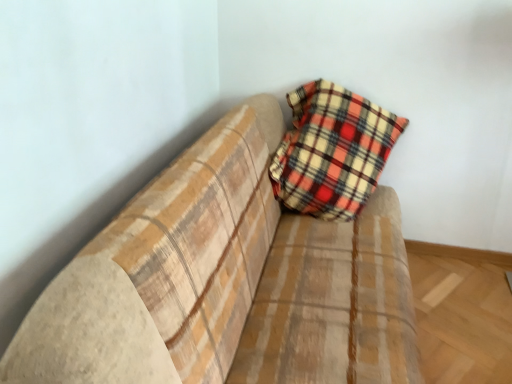
Find the location of `plaid fabric couch at upper right`. plaid fabric couch at upper right is located at coordinates (226, 282).

From the picture: Measure the distance between point (359,350) and camera.

They are 1.32 meters apart.

This screenshot has height=384, width=512. Describe the element at coordinates (226, 282) in the screenshot. I see `plaid fabric couch at upper right` at that location.

Measure the distance between plaid fabric couch at upper right and camera.

A distance of 24.68 inches exists between plaid fabric couch at upper right and camera.

What is the approximate width of plaid fabric couch at upper right?

plaid fabric couch at upper right is 93.91 centimeters in width.

The width and height of the screenshot is (512, 384). What are the coordinates of `plaid fabric pillow at center` in the screenshot? It's located at (332, 151).

What do you see at coordinates (332, 151) in the screenshot? The height and width of the screenshot is (384, 512). I see `plaid fabric pillow at center` at bounding box center [332, 151].

Where is `plaid fabric couch at upper right`? This screenshot has width=512, height=384. plaid fabric couch at upper right is located at coordinates (226, 282).

Is plaid fabric pillow at center to the left or to the right of plaid fabric couch at upper right in the image?

plaid fabric pillow at center is to the right of plaid fabric couch at upper right.

Is plaid fabric pillow at center positioned behind plaid fabric couch at upper right?

Yes, it is behind plaid fabric couch at upper right.

Considering the points (326, 144) and (378, 287), which point is in front, point (326, 144) or point (378, 287)?

The point (378, 287) is closer to the camera.

From the image's perspective, which object appears higher, plaid fabric pillow at center or plaid fabric couch at upper right?

plaid fabric pillow at center, from the image's perspective.

From a real-world perspective, who is located lower, plaid fabric pillow at center or plaid fabric couch at upper right?

plaid fabric couch at upper right, from a real-world perspective.

Does plaid fabric pillow at center have a lesser width compared to plaid fabric couch at upper right?

Yes.

Who is shorter, plaid fabric pillow at center or plaid fabric couch at upper right?

With less height is plaid fabric pillow at center.

Based on their sizes in the image, would you say plaid fabric pillow at center is bigger or smaller than plaid fabric couch at upper right?

Considering their sizes, plaid fabric pillow at center takes up less space than plaid fabric couch at upper right.

Do you think plaid fabric pillow at center is within plaid fabric couch at upper right, or outside of it?

plaid fabric pillow at center fits inside plaid fabric couch at upper right.

Can you see plaid fabric pillow at center touching plaid fabric couch at upper right?

They are not placed beside each other.

Is plaid fabric pillow at center oriented towards plaid fabric couch at upper right?

Yes, plaid fabric pillow at center is facing plaid fabric couch at upper right.

Measure the distance from plaid fabric pillow at center to plaid fabric couch at upper right.

They are 16.70 inches apart.

I want to click on pillow on the right of plaid fabric couch at upper right, so click(x=332, y=151).

Is plaid fabric couch at upper right to the right of plaid fabric pillow at center from the viewer's perspective?

Incorrect, plaid fabric couch at upper right is not on the right side of plaid fabric pillow at center.

From the picture: Which object is more forward, plaid fabric couch at upper right or plaid fabric pillow at center?

plaid fabric couch at upper right is closer to the camera.

Does point (7, 352) lie in front of point (311, 150)?

Yes.

Based on the photo, from the image's perspective, would you say plaid fabric couch at upper right is shown under plaid fabric pillow at center?

Yes, from the image's perspective, plaid fabric couch at upper right is beneath plaid fabric pillow at center.

From a real-world perspective, is plaid fabric couch at upper right located beneath plaid fabric pillow at center?

Yes.

Considering the sizes of objects plaid fabric couch at upper right and plaid fabric pillow at center in the image provided, who is thinner, plaid fabric couch at upper right or plaid fabric pillow at center?

With smaller width is plaid fabric pillow at center.

Can you confirm if plaid fabric couch at upper right is taller than plaid fabric pillow at center?

Yes, plaid fabric couch at upper right is taller than plaid fabric pillow at center.

Which of these two, plaid fabric couch at upper right or plaid fabric pillow at center, is smaller?

With smaller size is plaid fabric pillow at center.

Which is correct: plaid fabric couch at upper right is inside plaid fabric pillow at center, or outside of it?

plaid fabric couch at upper right is outside plaid fabric pillow at center.

Is plaid fabric couch at upper right in contact with plaid fabric pillow at center?

No, plaid fabric couch at upper right is not next to plaid fabric pillow at center.

Is plaid fabric couch at upper right oriented away from plaid fabric pillow at center?

No, plaid fabric pillow at center is not at the back of plaid fabric couch at upper right.

What's the angular difference between plaid fabric couch at upper right and plaid fabric pillow at center's facing directions?

The angle between the facing direction of plaid fabric couch at upper right and the facing direction of plaid fabric pillow at center is 70 degrees.

This screenshot has height=384, width=512. Identify the location of studio couch below the plaid fabric pillow at center (from a real-world perspective). (226, 282).

Locate an element on the screen. Image resolution: width=512 pixels, height=384 pixels. pillow located on the right of plaid fabric couch at upper right is located at coordinates (332, 151).

Locate an element on the screen. This screenshot has height=384, width=512. studio couch that is under the plaid fabric pillow at center (from a real-world perspective) is located at coordinates (226, 282).